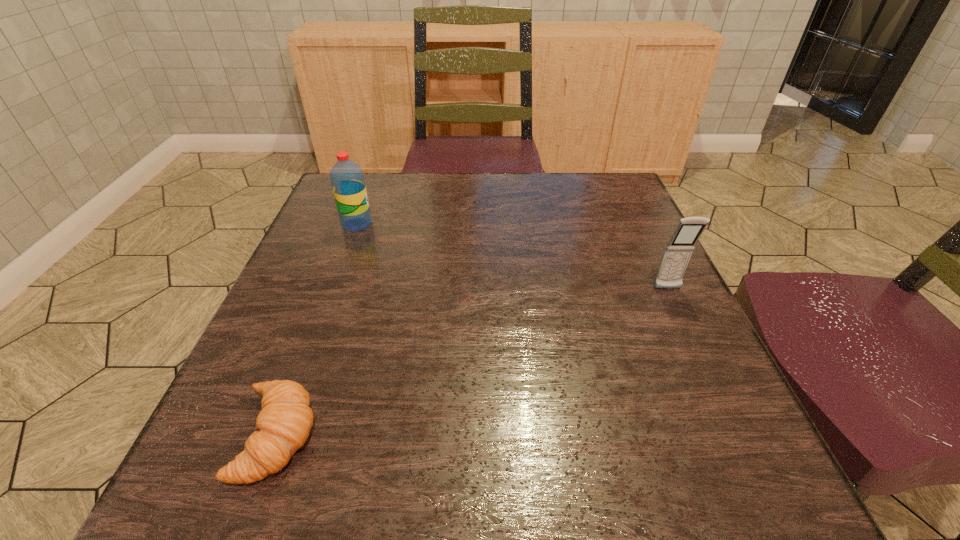
Identify the location of vacant space at the far right corner of the desktop. (589, 220).

Find the location of a particular element. vacant space at the near right corner of the desktop is located at coordinates (719, 467).

What are the coordinates of `free space between the water bottle and the nearest object` in the screenshot? It's located at (317, 330).

At what (x,y) coordinates should I click in order to perform the action: click on empty space that is in between the rightmost object and the shortest object. Please return your answer as a coordinate pair (x, y). Looking at the image, I should click on (472, 362).

You are a GUI agent. You are given a task and a screenshot of the screen. Output one action in this format:
    pyautogui.click(x=<x>, y=<y>)
    Task: Click on the free space between the farthest object and the cellular telephone
    
    Given the screenshot: What is the action you would take?
    pyautogui.click(x=513, y=256)

The width and height of the screenshot is (960, 540). Find the location of `vacant space that's between the farthest object and the crescent roll`. vacant space that's between the farthest object and the crescent roll is located at coordinates (317, 330).

Where is `empty space between the second farthest object and the farthest object`? empty space between the second farthest object and the farthest object is located at coordinates (513, 256).

The image size is (960, 540). What are the coordinates of `free space that is in between the rightmost object and the crescent roll` in the screenshot? It's located at (472, 362).

Find the location of a particular element. This screenshot has width=960, height=540. free space between the nearest object and the water bottle is located at coordinates (317, 330).

This screenshot has width=960, height=540. Identify the location of free space that is in between the cellular telephone and the nearest object. (472, 362).